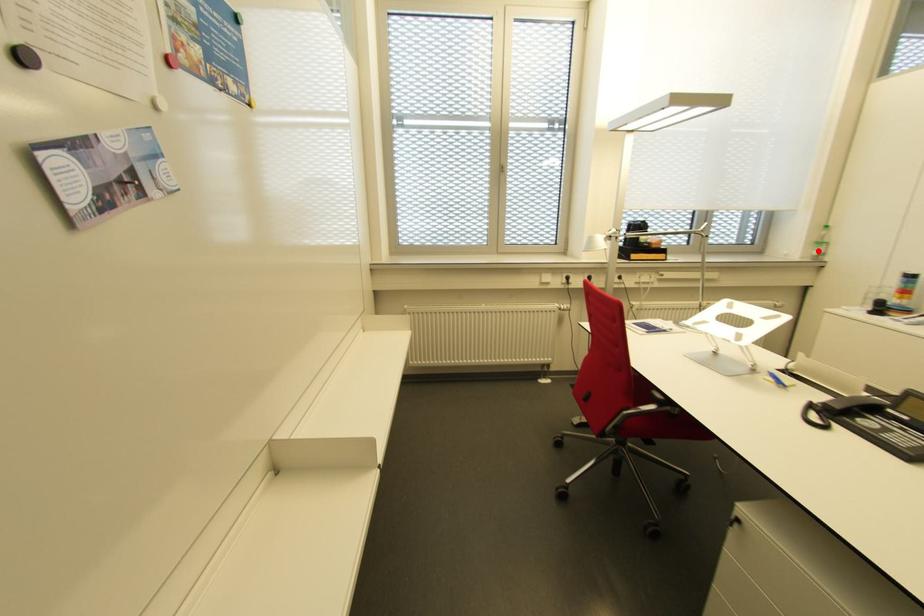
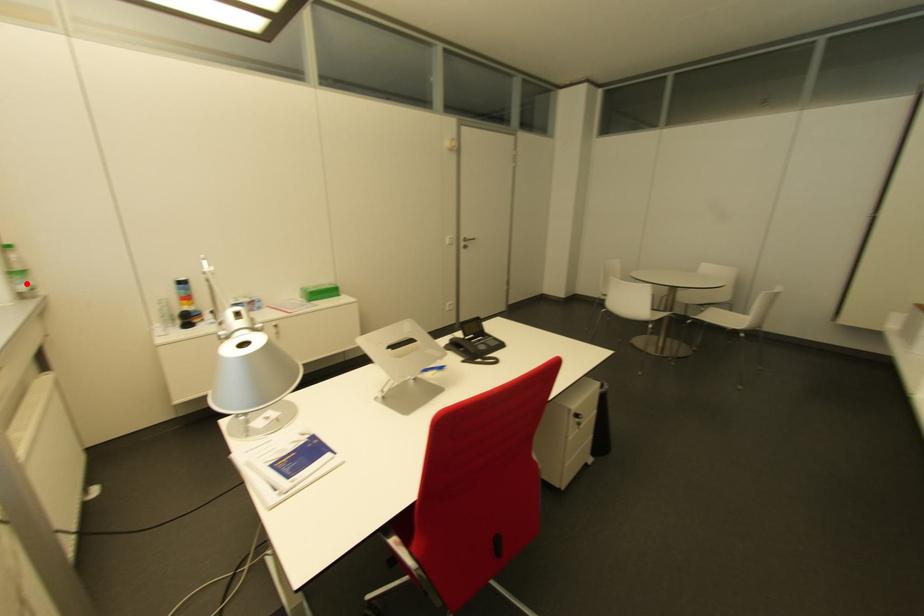
I am providing you with two images of the same scene from different viewpoints. A red point is marked on the first image and another point is marked on the second image. Does the point marked in image1 correspond to the same location as the one in image2?

Yes